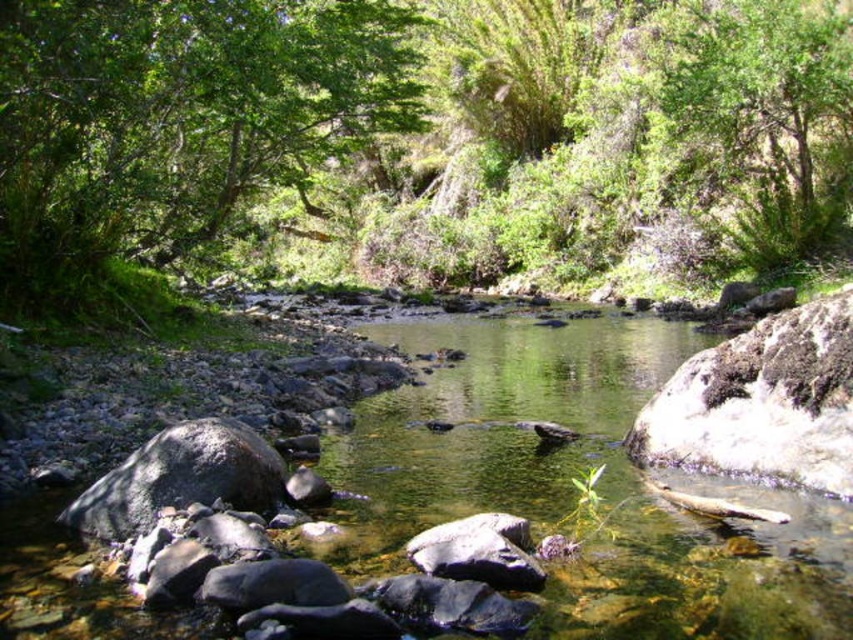
Based on the coordinates provided, which part of the scene does the point at (427,125) correspond to?

The point at (427,125) corresponds to the green leafy forest at center.

You are standing at the origin point of the image. Which direction should you move to reach the clear water at center?

The clear water at center is located at coordinate point 0.762 on the x axis and 0.672 on the y axis, so you should move towards the right and forward to reach it.

You are standing at the point marked as point (173,118) in the image. What type of object are you currently standing on?

The point (173,118) is on a green leafy tree at upper left, so you are standing on a green leafy tree.